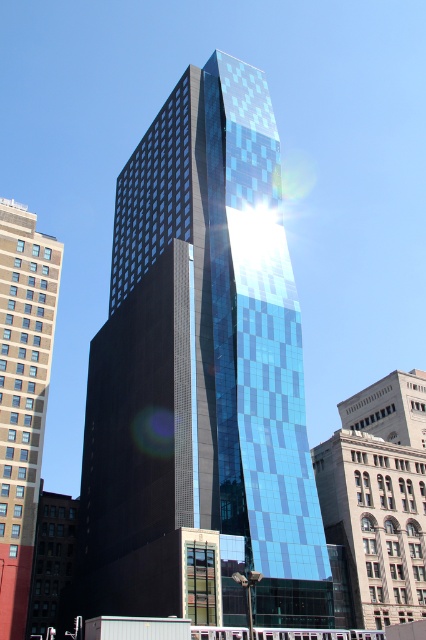
Does blue glass skyscraper at center appear under beige concrete building at left?

Correct, blue glass skyscraper at center is located below beige concrete building at left.

This screenshot has height=640, width=426. What are the coordinates of `blue glass skyscraper at center` in the screenshot? It's located at (379, 497).

The width and height of the screenshot is (426, 640). In order to click on blue glass skyscraper at center in this screenshot , I will do `click(379, 497)`.

Measure the distance between shiny glass skyscraper at center and beige concrete building at left.

shiny glass skyscraper at center and beige concrete building at left are 17.37 meters apart from each other.

Between shiny glass skyscraper at center and beige concrete building at left, which one has more height?

Standing taller between the two is shiny glass skyscraper at center.

Is point (222, 481) farther from camera compared to point (2, 262)?

That is False.

Find the location of a particular element. shiny glass skyscraper at center is located at coordinates (201, 376).

Who is more distant from viewer, (x=233, y=186) or (x=379, y=456)?

The point (x=233, y=186) is behind.

Is point (250, 156) farther from camera compared to point (408, 493)?

Yes, point (250, 156) is farther from viewer.

I want to click on shiny glass skyscraper at center, so click(x=201, y=376).

You are a GUI agent. You are given a task and a screenshot of the screen. Output one action in this format:
    pyautogui.click(x=<x>, y=<y>)
    Task: Click on the shiny glass skyscraper at center
    The height and width of the screenshot is (640, 426).
    Given the screenshot: What is the action you would take?
    pyautogui.click(x=201, y=376)